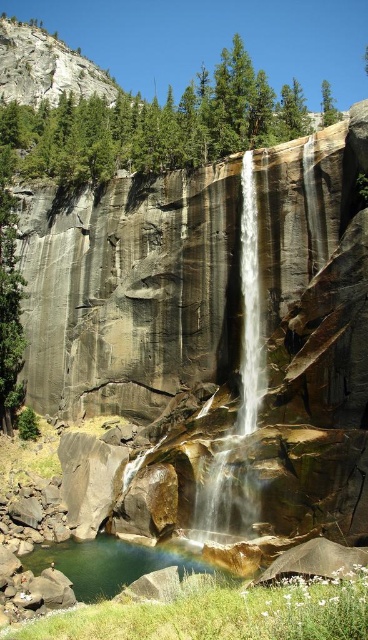
Find the location of a particular element. The height and width of the screenshot is (640, 368). white smooth waterfall at center is located at coordinates (239, 374).

Can you confirm if white smooth waterfall at center is positioned above clear water at lower center?

Indeed, white smooth waterfall at center is positioned over clear water at lower center.

This screenshot has height=640, width=368. What do you see at coordinates (239, 374) in the screenshot?
I see `white smooth waterfall at center` at bounding box center [239, 374].

This screenshot has width=368, height=640. Identify the location of white smooth waterfall at center. (239, 374).